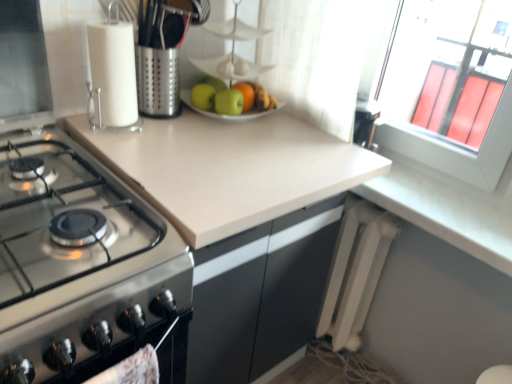
Locate an element on the screen. This screenshot has width=512, height=384. space that is in front of glossy orange at center is located at coordinates (234, 132).